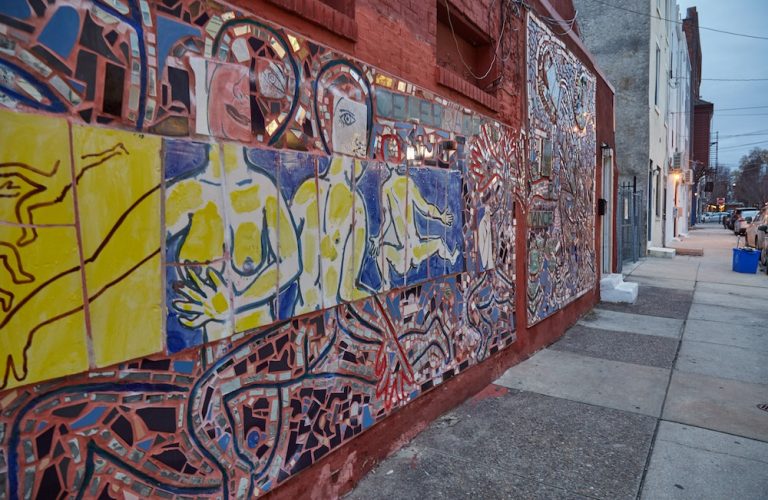
What are the coordinates of `doorway` in the screenshot? It's located at (606, 247).